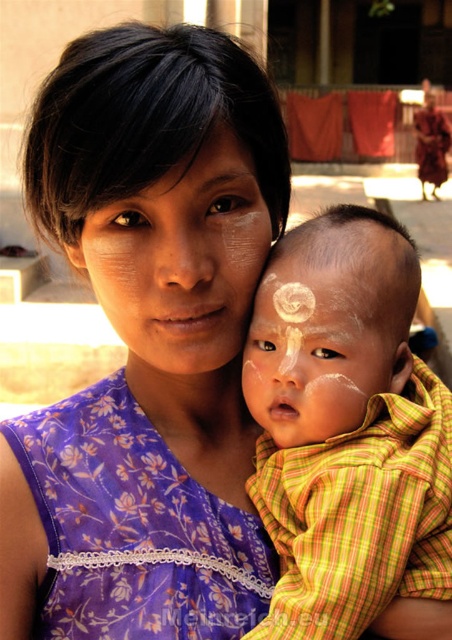
You are a photographer setting up for a family portrait. You have a camera with a focal length of 50mm. The subject is the purple floral fabric dress at center and the pale skin with white markings at center. To ensure both are in focus, what should the minimum distance be between the camera and the subjects?

The minimum distance should be at least 32.73 inches to ensure both the purple floral fabric dress at center and the pale skin with white markings at center are in focus.

You are an anthropologist studying traditional clothing. In the scene described, where is the purple floral fabric dress at center positioned relative to the woman and the baby?

The purple floral fabric dress at center is located at point (133, 529), which places it centrally in the image between the woman on the left and the baby on the right.